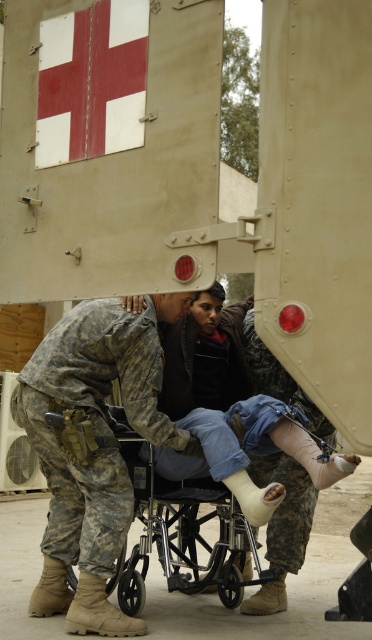
Question: Is camouflage fabric at center above metallic silver wheelchair at center?

Choices:
 (A) no
 (B) yes

Answer: (B)

Question: Among these objects, which one is nearest to the camera?

Choices:
 (A) camouflage fabric at center
 (B) metallic silver wheelchair at center

Answer: (A)

Question: Which of the following is the farthest from the observer?

Choices:
 (A) (88, 337)
 (B) (242, 592)

Answer: (B)

Question: Does camouflage fabric at center appear on the right side of metallic silver wheelchair at center?

Choices:
 (A) yes
 (B) no

Answer: (B)

Question: Can you confirm if camouflage fabric at center is positioned to the right of metallic silver wheelchair at center?

Choices:
 (A) no
 (B) yes

Answer: (A)